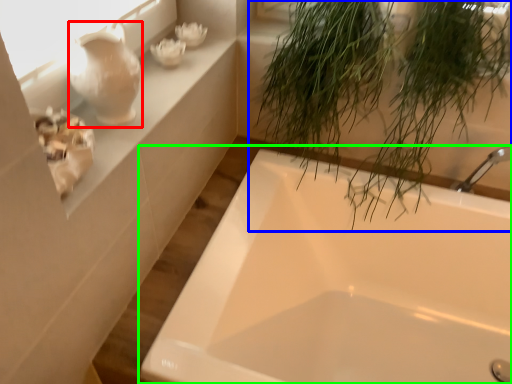
Question: Considering the real-world distances, which object is farthest from glass vase (highlighted by a red box)? houseplant (highlighted by a blue box) or bathtub (highlighted by a green box)?

Choices:
 (A) houseplant
 (B) bathtub

Answer: (B)